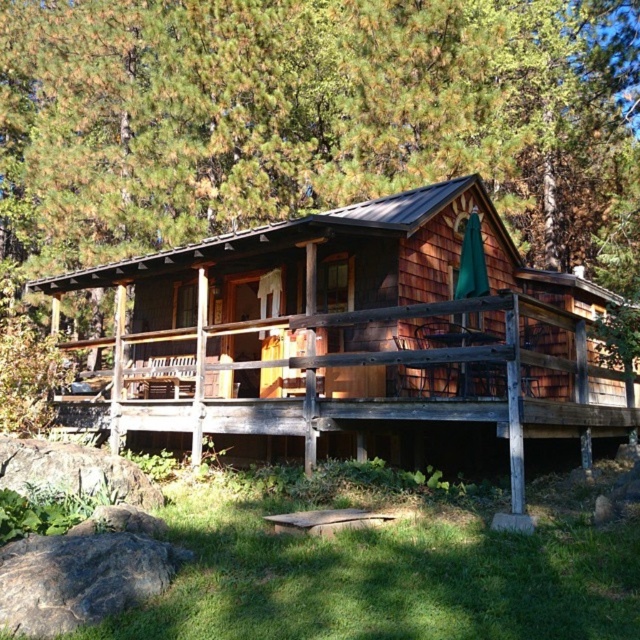
Between green shingles at upper center and weathered wood porch at center, which one has less height?

weathered wood porch at center

Which is in front, point (284, 113) or point (428, 305)?

Point (428, 305) is more forward.

What are the coordinates of `green shingles at upper center` in the screenshot? It's located at (314, 120).